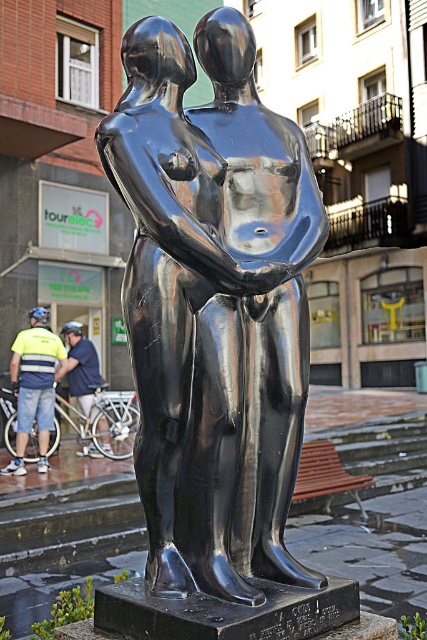
Which is below, polished black statue at center or yellow-green shirt at left?

yellow-green shirt at left

Is polished black statue at center taller than yellow-green shirt at left?

In fact, polished black statue at center may be shorter than yellow-green shirt at left.

Where is `polished black statue at center`? This screenshot has height=640, width=427. polished black statue at center is located at coordinates (213, 307).

Where is `polished black statue at center`? polished black statue at center is located at coordinates (213, 307).

Is yellow-green shirt at left bigger than matte blue helmet at left?

Indeed, yellow-green shirt at left has a larger size compared to matte blue helmet at left.

Is point (29, 426) positioned behind point (67, 360)?

No, it is in front of (67, 360).

Image resolution: width=427 pixels, height=640 pixels. In order to click on yellow-green shirt at left in this screenshot , I will do `click(35, 387)`.

Between point (227, 74) and point (75, 380), which one is positioned in front?

Point (227, 74) is more forward.

What do you see at coordinates (213, 307) in the screenshot? I see `polished black statue at center` at bounding box center [213, 307].

Does point (140, 145) come in front of point (98, 368)?

Yes.

The image size is (427, 640). Find the location of `polished black statue at center`. polished black statue at center is located at coordinates (213, 307).